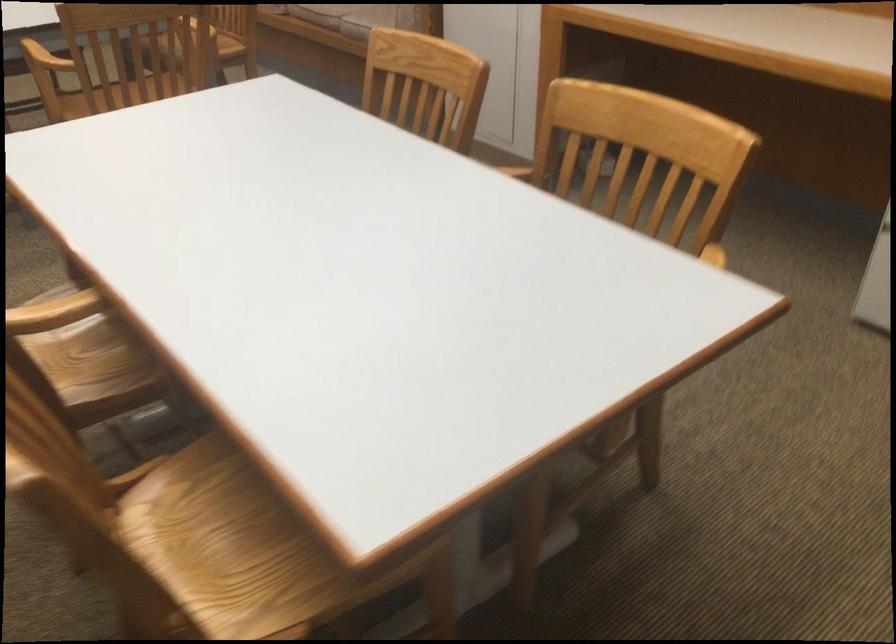
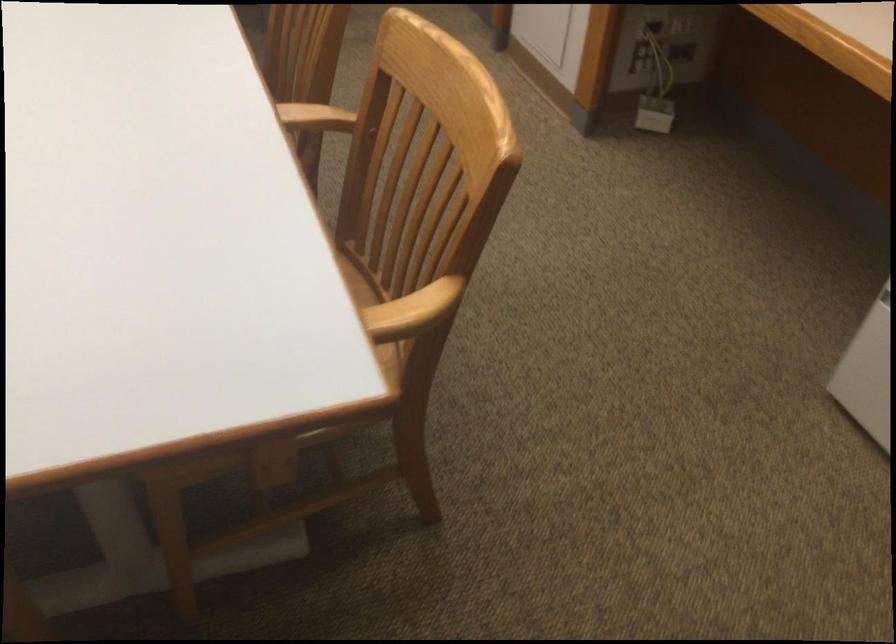
In a continuous first-person perspective shot, in which direction is the camera moving?

The cameraman walked toward right, forward.